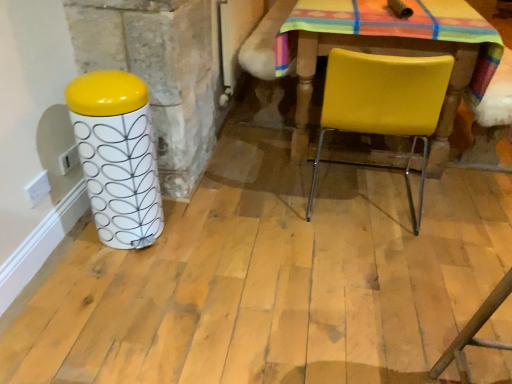
Identify the location of free spot to the right of yellow leather chair at center. (456, 206).